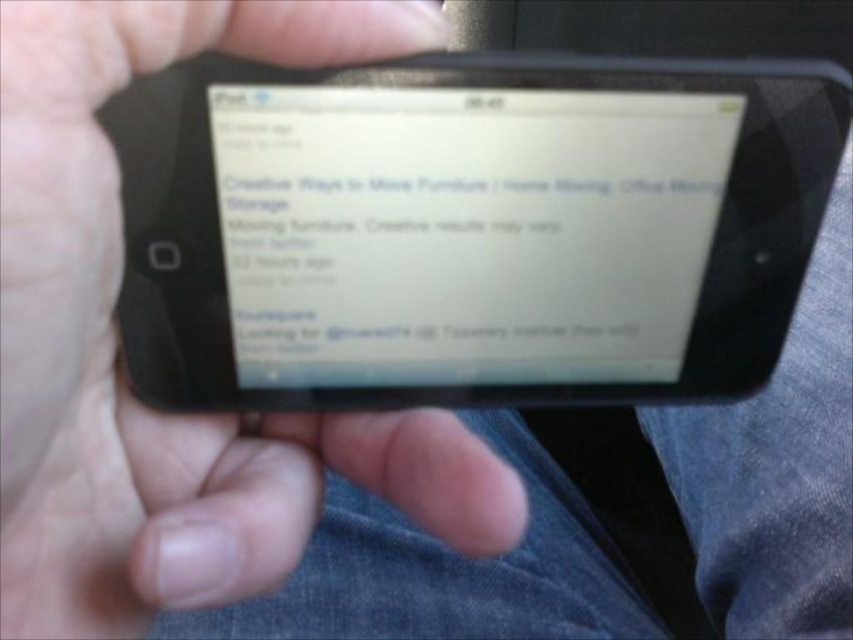
Question: Does black matte phone at center have a smaller size compared to white matte screen at center?

Choices:
 (A) yes
 (B) no

Answer: (B)

Question: Which object appears farthest from the camera in this image?

Choices:
 (A) black matte phone at center
 (B) white matte screen at center

Answer: (B)

Question: Is black matte phone at center positioned in front of white matte screen at center?

Choices:
 (A) yes
 (B) no

Answer: (A)

Question: Is black matte phone at center smaller than white matte screen at center?

Choices:
 (A) no
 (B) yes

Answer: (A)

Question: Which object appears farthest from the camera in this image?

Choices:
 (A) black matte phone at center
 (B) white matte screen at center

Answer: (B)